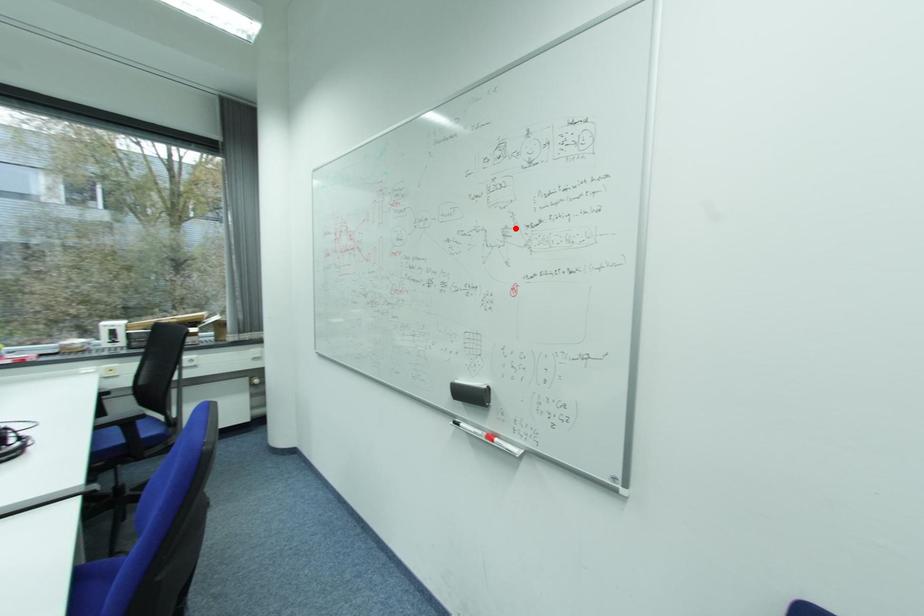
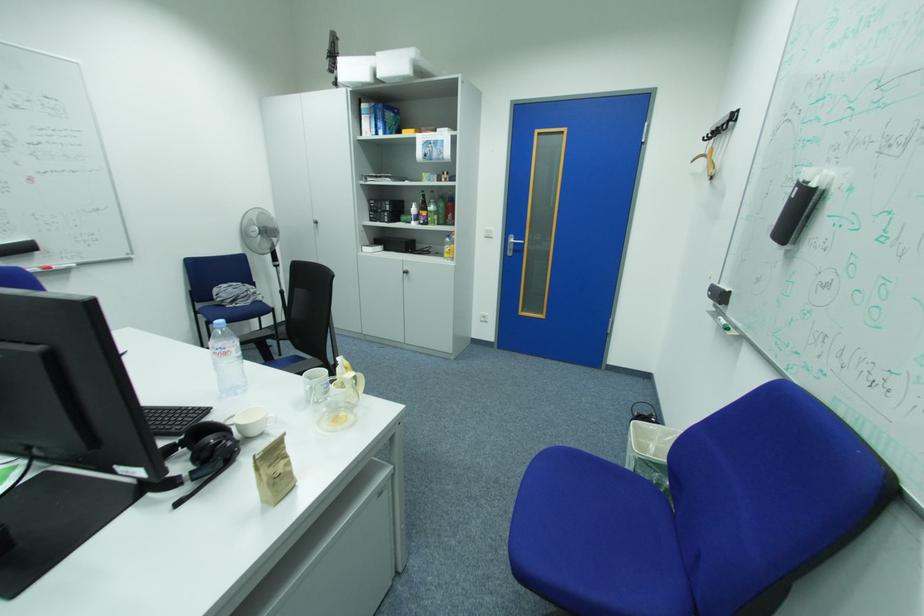
The point at the highlighted location is marked in the first image. Where is the corresponding point in the second image?

(14, 140)